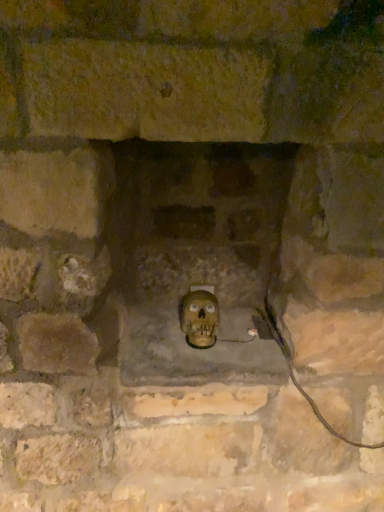
I want to click on vacant space to the left of matte brown skull at center, so click(153, 344).